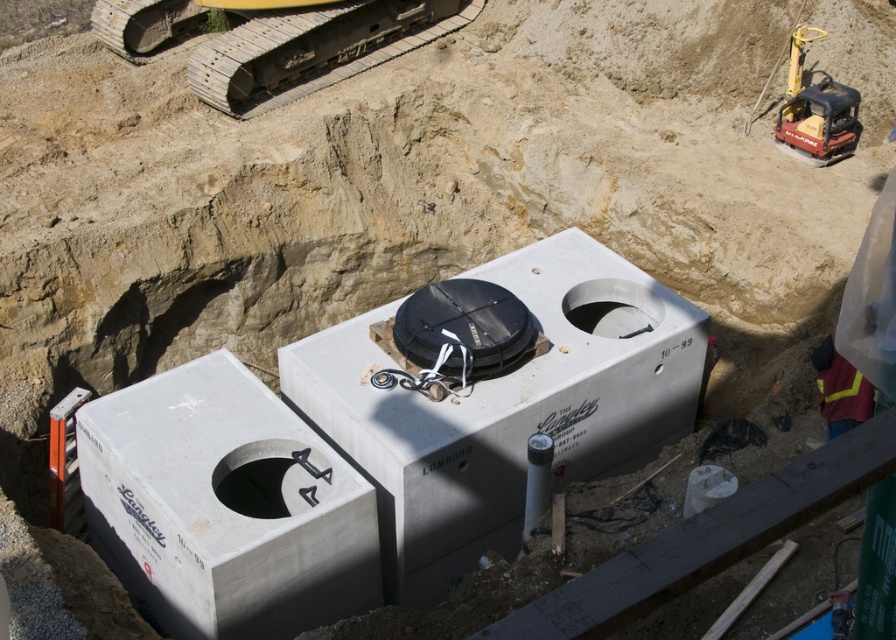
You are a construction worker who needs to place a 1.2 meter tall safety barrier between the gray metallic tracks at upper left and the smooth concrete hole at center. Can the barrier fit vertically between them without touching either object?

The gray metallic tracks at upper left is taller than smooth concrete hole at center, so the 1.2 meter tall safety barrier cannot fit vertically between them because the tracks are taller and would block the space.

You are a construction worker needing to access the smooth concrete hole at center. There are gray metallic tracks at upper left in your path. Can you step over them to reach the hole?

The gray metallic tracks at upper left are further to the viewer than the smooth concrete hole at center, meaning the tracks are closer to you. Since the tracks are closer, you can step over them to reach the smooth concrete hole at center.

You are a construction worker who needs to place a new safety sign between the gray concrete water tank at center and the reflective yellow vest at lower right. Based on their positions, which object should the sign be placed closer to?

The gray concrete water tank at center is to the left of reflective yellow vest at lower right, so the safety sign should be placed closer to the reflective yellow vest at lower right to ensure it is between both objects.